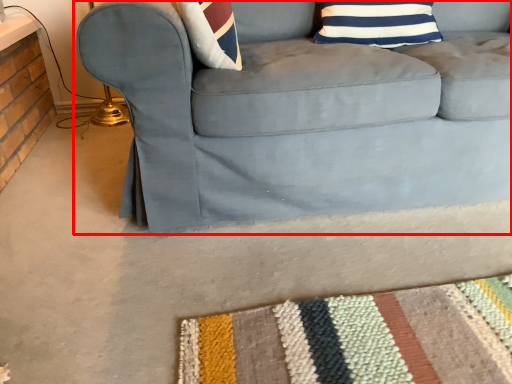
Question: From the image's perspective, where is studio couch (annotated by the red box) located relative to pillow?

Choices:
 (A) above
 (B) below

Answer: (B)